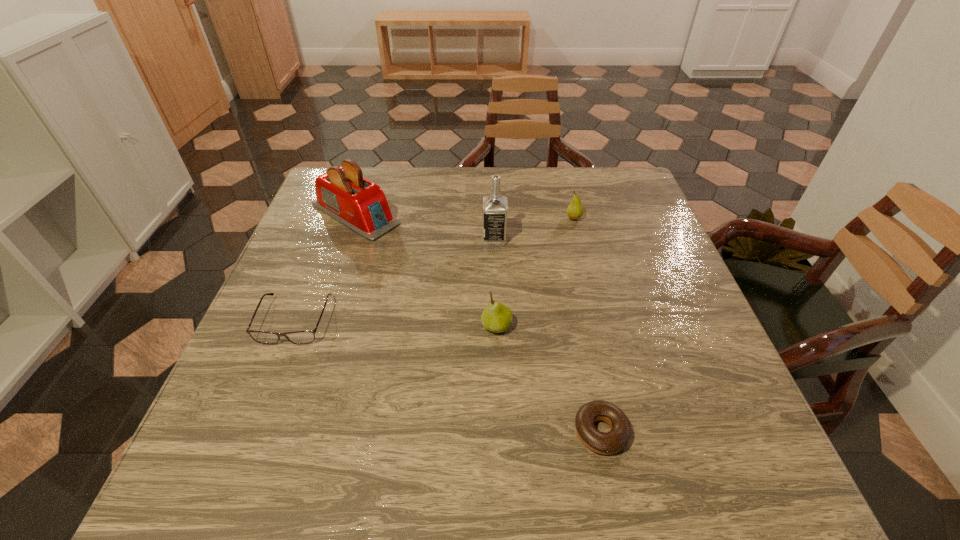
I want to click on free space located on the front of the left pear, so click(x=500, y=441).

The height and width of the screenshot is (540, 960). Identify the location of free point located 0.180m on the right of the right pear. (648, 219).

Locate an element on the screen. The height and width of the screenshot is (540, 960). free location located 0.100m on the lenses of the spectacles is located at coordinates (268, 388).

The width and height of the screenshot is (960, 540). Identify the location of vacant space located 0.370m on the back of the doughnut. (566, 267).

Image resolution: width=960 pixels, height=540 pixels. What are the coordinates of `object present at the far edge` in the screenshot? It's located at (342, 193).

This screenshot has width=960, height=540. Identify the location of object at the near edge. (611, 442).

Where is `toaster located in the left edge section of the desktop`? toaster located in the left edge section of the desktop is located at coordinates (342, 193).

Find the location of a particular element. The height and width of the screenshot is (540, 960). spectacles at the left edge is located at coordinates (297, 337).

Locate an element on the screen. The width and height of the screenshot is (960, 540). object that is at the far left corner is located at coordinates (342, 193).

The height and width of the screenshot is (540, 960). In the image, there is a desktop. Identify the location of vacant space at the far edge. (387, 187).